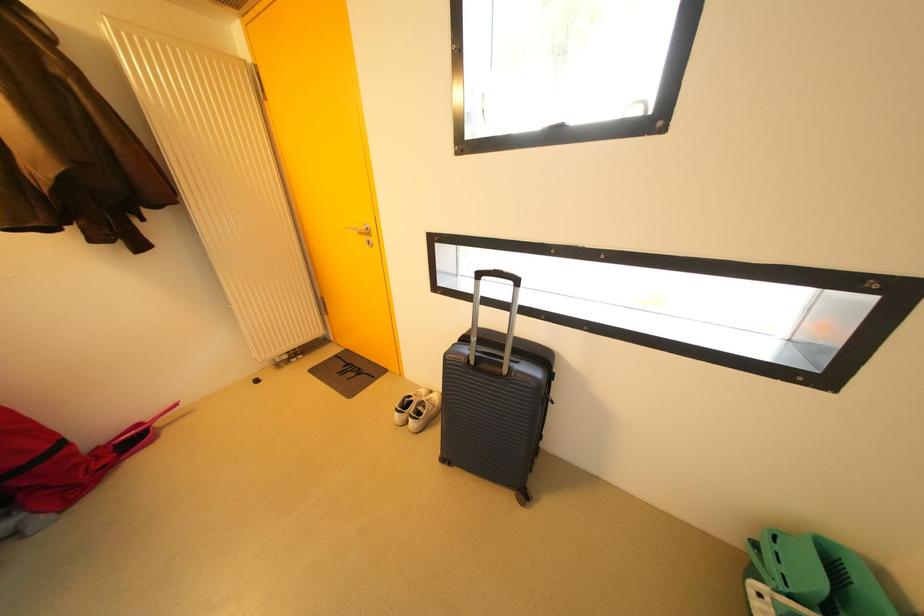
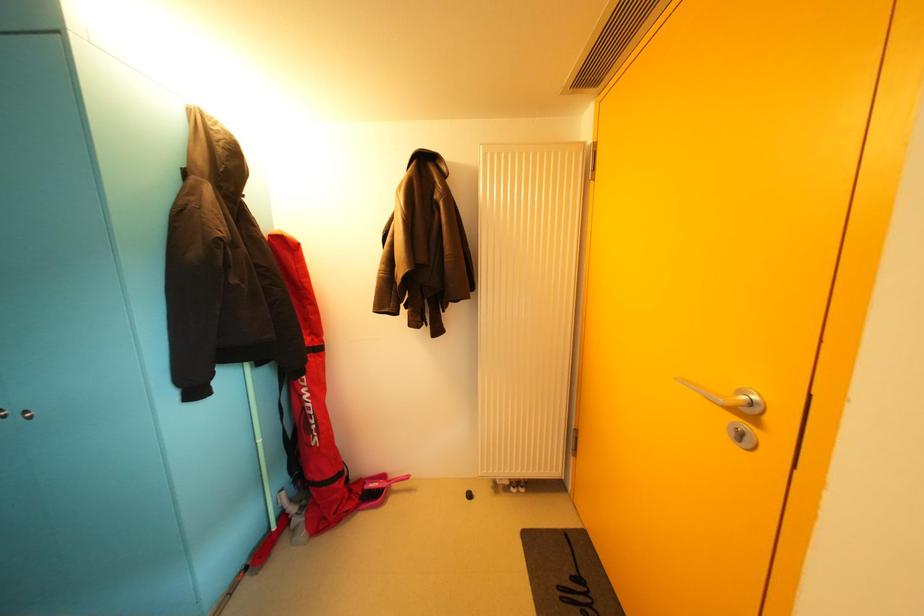
Question: The first image is from the beginning of the video and the second image is from the end. How did the camera likely rotate when shooting the video?

Choices:
 (A) Left
 (B) Right
 (C) Up
 (D) Down

Answer: (A)